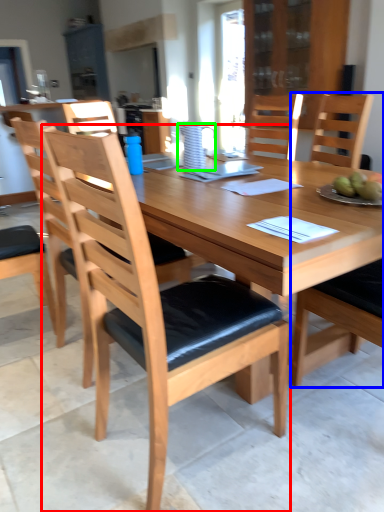
Question: Estimate the real-world distances between objects in this image. Which object is closer to chair (highlighted by a red box), chair (highlighted by a blue box) or pitcher (highlighted by a green box)?

Choices:
 (A) chair
 (B) pitcher

Answer: (B)